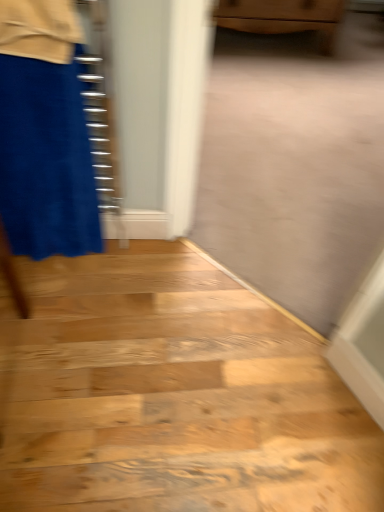
Question: Should I look upward or downward to see wooden cabinet at upper center?

Choices:
 (A) down
 (B) up

Answer: (B)

Question: From the image's perspective, is wooden cabinet at upper center located beneath wooden floor at lower left?

Choices:
 (A) yes
 (B) no

Answer: (B)

Question: Is the depth of wooden cabinet at upper center less than that of wooden floor at lower left?

Choices:
 (A) no
 (B) yes

Answer: (A)

Question: Can you confirm if wooden cabinet at upper center is positioned to the right of wooden floor at lower left?

Choices:
 (A) yes
 (B) no

Answer: (A)

Question: From a real-world perspective, is wooden cabinet at upper center located beneath wooden floor at lower left?

Choices:
 (A) yes
 (B) no

Answer: (B)

Question: Is wooden cabinet at upper center oriented towards wooden floor at lower left?

Choices:
 (A) yes
 (B) no

Answer: (A)

Question: Is wooden cabinet at upper center not inside wooden floor at lower left?

Choices:
 (A) no
 (B) yes

Answer: (B)

Question: Is wooden floor at lower left to the right of velvet blue miniskirt at left from the viewer's perspective?

Choices:
 (A) yes
 (B) no

Answer: (A)

Question: Is the position of wooden floor at lower left less distant than that of velvet blue miniskirt at left?

Choices:
 (A) yes
 (B) no

Answer: (B)

Question: Considering the relative sizes of wooden floor at lower left and velvet blue miniskirt at left in the image provided, is wooden floor at lower left smaller than velvet blue miniskirt at left?

Choices:
 (A) yes
 (B) no

Answer: (B)

Question: Is wooden floor at lower left further to the viewer compared to velvet blue miniskirt at left?

Choices:
 (A) yes
 (B) no

Answer: (A)

Question: Is wooden floor at lower left at the left side of velvet blue miniskirt at left?

Choices:
 (A) yes
 (B) no

Answer: (B)

Question: From a real-world perspective, is wooden floor at lower left beneath velvet blue miniskirt at left?

Choices:
 (A) yes
 (B) no

Answer: (A)

Question: Does velvet blue miniskirt at left have a larger size compared to wooden floor at lower left?

Choices:
 (A) yes
 (B) no

Answer: (B)